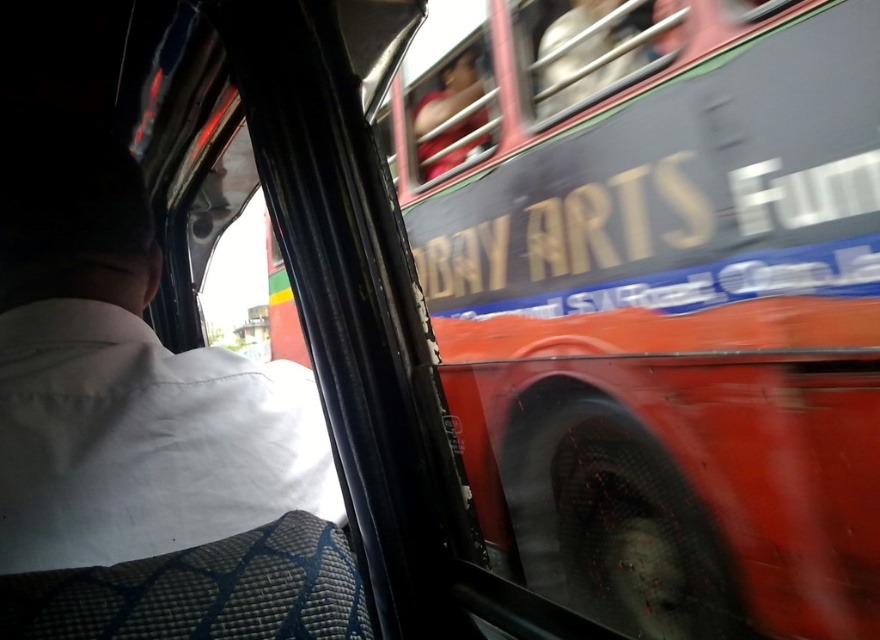
Based on the scene description, where is the white fabric shirt at left located in the image?

The white fabric shirt at left is located at point (125, 381).

You are a passenger on a bus and notice two objects through the windshield. One is the white fabric shirt at left and the other is the metallic red bus window at upper center. Which object is closer to you?

The white fabric shirt at left is closer to you because it is in front of the metallic red bus window at upper center.